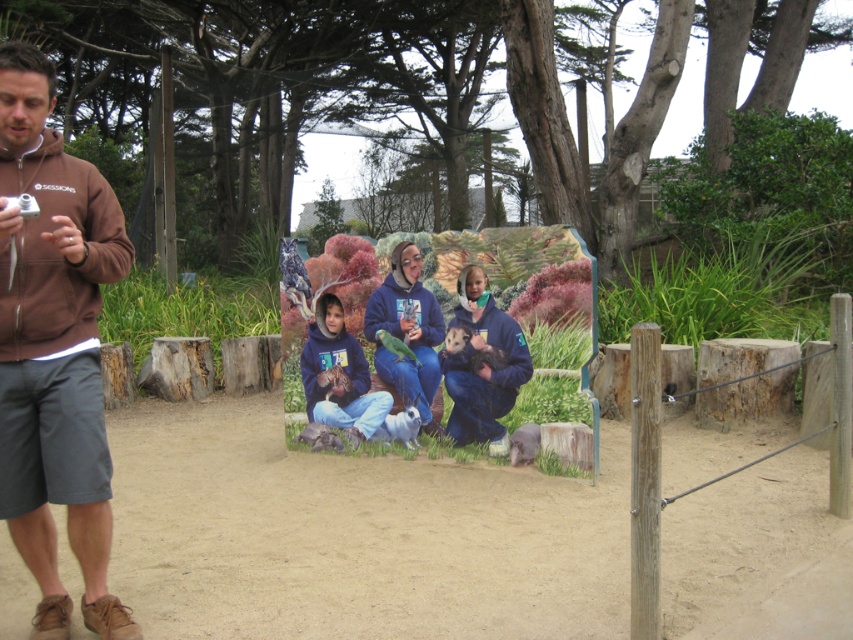
Question: Among these points, which one is nearest to the camera?

Choices:
 (A) (489, 436)
 (B) (71, 321)

Answer: (B)

Question: Is brown hoodie at left to the right of matte blue jacket at center from the viewer's perspective?

Choices:
 (A) yes
 (B) no

Answer: (B)

Question: Does brown hoodie at left appear on the right side of matte blue jacket at center?

Choices:
 (A) no
 (B) yes

Answer: (A)

Question: Can you confirm if brown hoodie at left is thinner than matte blue jacket at center?

Choices:
 (A) no
 (B) yes

Answer: (B)

Question: Among these points, which one is nearest to the camera?

Choices:
 (A) (77, 445)
 (B) (454, 316)

Answer: (A)